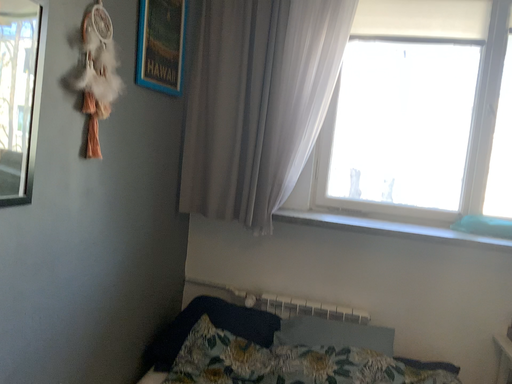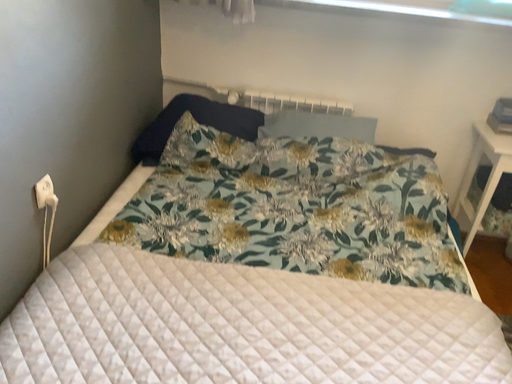
Question: How did the camera likely rotate when shooting the video?

Choices:
 (A) rotated upward
 (B) rotated downward

Answer: (B)